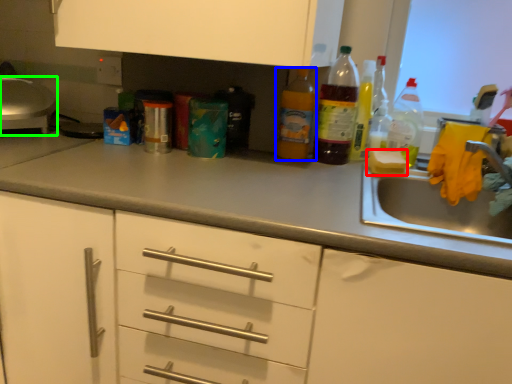
Question: Which object is positioned closest to food (highlighted by a red box)? Select from bottle (highlighted by a blue box) and appliance (highlighted by a green box).

Choices:
 (A) bottle
 (B) appliance

Answer: (A)